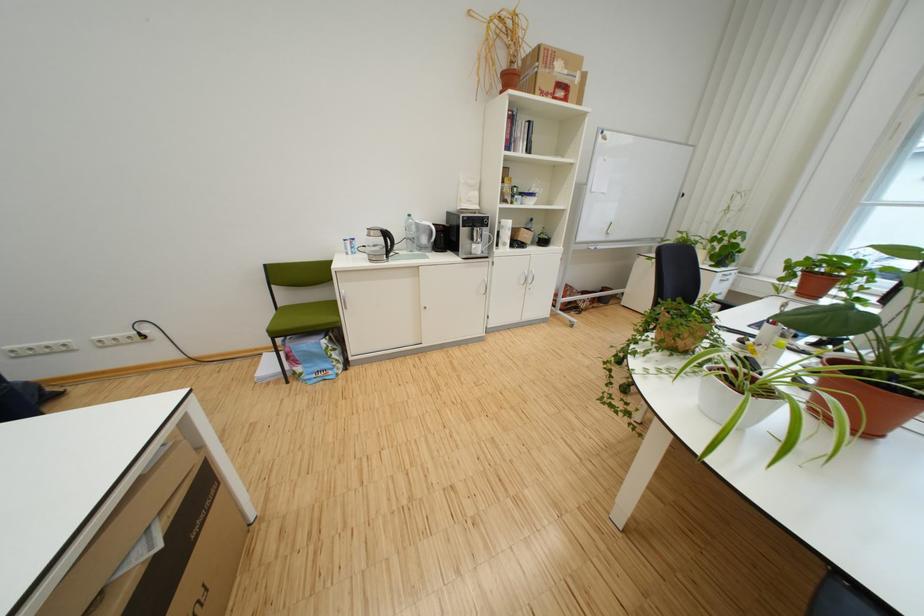
Locate an element on the screen. sliding cabinet handle is located at coordinates (488, 285).